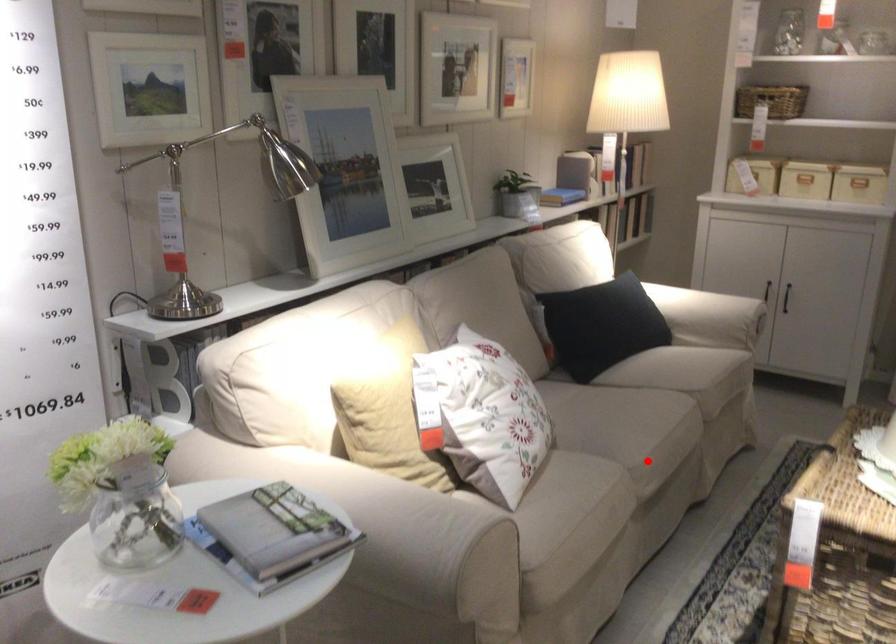
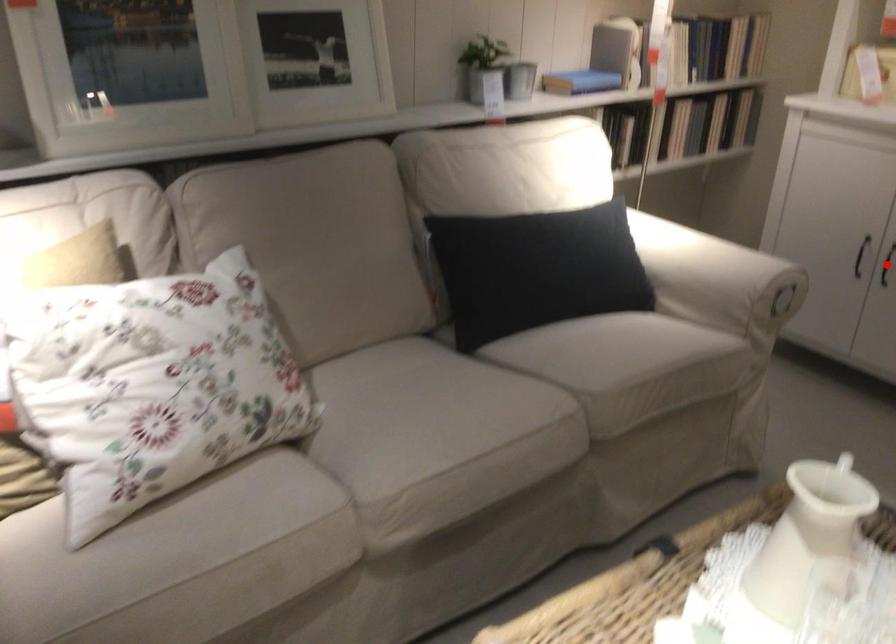
I am providing you with two images of the same scene from different viewpoints. A red point is marked on the first image and another point is marked on the second image. Do the highlighted points in image1 and image2 indicate the same real-world spot?

No